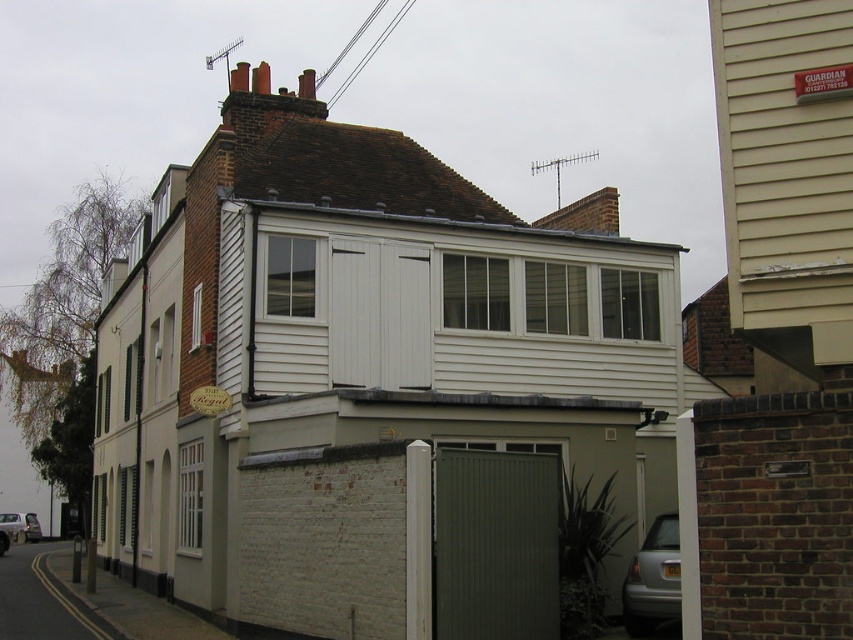
Does white wood shed at center appear over dark green corrugated metal at center?

Indeed, white wood shed at center is positioned over dark green corrugated metal at center.

Which is more to the right, white wood shed at center or dark green corrugated metal at center?

Positioned to the right is dark green corrugated metal at center.

Does point (204, 163) lie in front of point (448, 531)?

No, it is not.

The height and width of the screenshot is (640, 853). What are the coordinates of `white wood shed at center` in the screenshot? It's located at (363, 333).